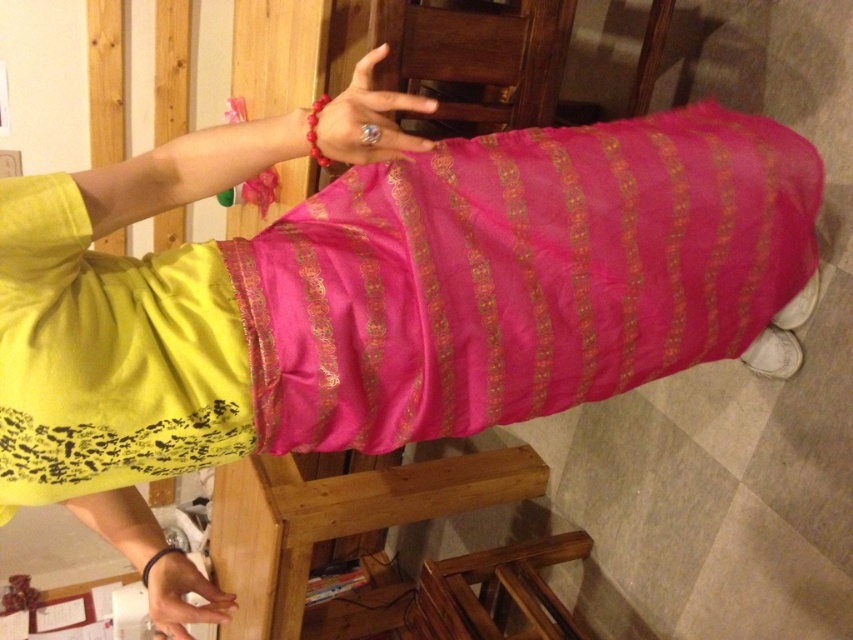
From the picture: Which of these two, shiny silk dress at center or matte gold ring at upper center, stands taller?

shiny silk dress at center

You are a GUI agent. You are given a task and a screenshot of the screen. Output one action in this format:
    pyautogui.click(x=<x>, y=<y>)
    Task: Click on the shiny silk dress at center
    The width and height of the screenshot is (853, 640).
    Given the screenshot: What is the action you would take?
    pyautogui.click(x=397, y=300)

Is the position of matte gold ring at upper center less distant than that of matte pink fabric at lower center?

That is True.

Is matte gold ring at upper center below matte pink fabric at lower center?

No, matte gold ring at upper center is not below matte pink fabric at lower center.

Which is in front, point (323, 145) or point (172, 624)?

Point (323, 145) is in front.

Locate an element on the screen. Image resolution: width=853 pixels, height=640 pixels. matte gold ring at upper center is located at coordinates (364, 120).

Is point (675, 298) farther from camera compared to point (183, 632)?

No, (675, 298) is closer to viewer.

Measure the distance between shiny silk dress at center and matte pink fabric at lower center.

A distance of 23.38 inches exists between shiny silk dress at center and matte pink fabric at lower center.

Image resolution: width=853 pixels, height=640 pixels. Find the location of `shiny silk dress at center`. shiny silk dress at center is located at coordinates pos(397,300).